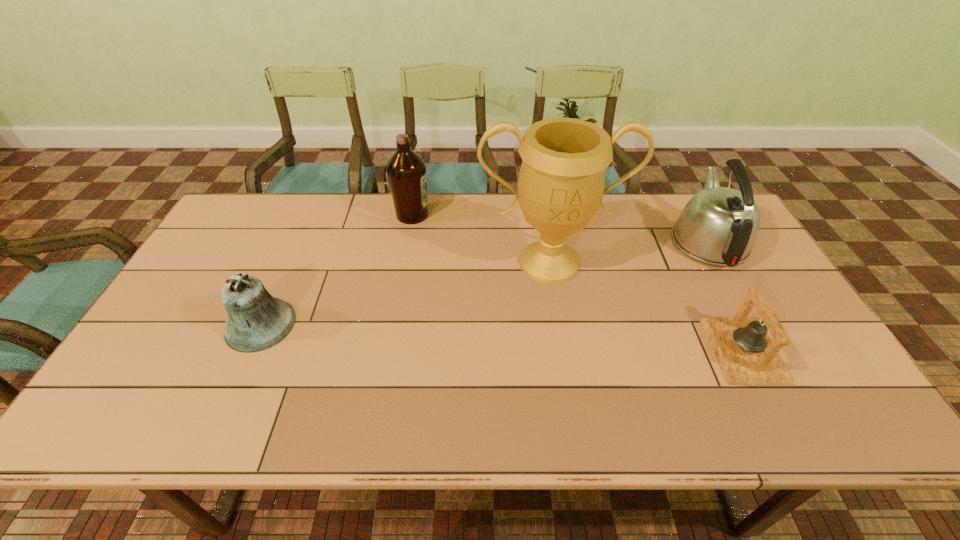
This screenshot has width=960, height=540. In order to click on vacant region at the near edge in this screenshot , I will do `click(281, 420)`.

At what (x,y) coordinates should I click in order to perform the action: click on vacant space at the right edge. Please return your answer as a coordinate pair (x, y). This screenshot has width=960, height=540. Looking at the image, I should click on (803, 333).

You are a GUI agent. You are given a task and a screenshot of the screen. Output one action in this format:
    pyautogui.click(x=<x>, y=<y>)
    Task: Click on the free space at the near right corner of the desktop
    This screenshot has width=960, height=540.
    Given the screenshot: What is the action you would take?
    pyautogui.click(x=848, y=427)

This screenshot has height=540, width=960. Identify the location of free space between the trophy and the second shortest object. (405, 293).

Locate an element on the screen. The image size is (960, 540). vacant region between the shortest object and the second object from left to right is located at coordinates (578, 282).

This screenshot has height=540, width=960. I want to click on blank region between the left bell and the olive oil, so click(336, 270).

This screenshot has width=960, height=540. Find the location of `free space between the third object from right to left and the kettle`. free space between the third object from right to left and the kettle is located at coordinates (629, 252).

At what (x,y) coordinates should I click in order to perform the action: click on vacant region between the right bell and the kettle. Please return your answer as a coordinate pair (x, y). The height and width of the screenshot is (540, 960). Looking at the image, I should click on (726, 295).

Where is `vacant area that lies between the right bell and the third object from right to left`? The height and width of the screenshot is (540, 960). vacant area that lies between the right bell and the third object from right to left is located at coordinates tap(646, 306).

Image resolution: width=960 pixels, height=540 pixels. Identify the location of vacant area between the kettle and the shorter bell. (726, 295).